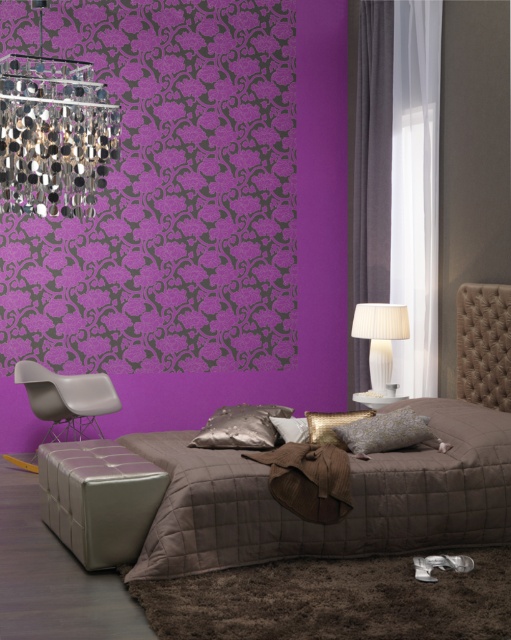
Question: Among these objects, which one is nearest to the camera?

Choices:
 (A) white pleated fabric lampshade at right
 (B) shiny metallic chandelier at upper left
 (C) brown quilted bed at center

Answer: (C)

Question: Does purple velvet curtain at right appear under white pleated fabric lampshade at right?

Choices:
 (A) yes
 (B) no

Answer: (B)

Question: Can you confirm if metallic silver pillow at center is bigger than gold metallic pillow at center?

Choices:
 (A) yes
 (B) no

Answer: (A)

Question: Which point is closer to the camera?

Choices:
 (A) (92, 150)
 (B) (53, 513)
 (C) (247, 413)
 (D) (321, 435)

Answer: (A)

Question: Which object is positioned farthest from the matte gray ottoman at lower left?

Choices:
 (A) matte gray chair at lower left
 (B) gold textured pillow at center
 (C) white sheer curtain at upper right

Answer: (C)

Question: Where is purple velvet curtain at right located in relation to gold metallic pillow at center in the image?

Choices:
 (A) right
 (B) left

Answer: (A)